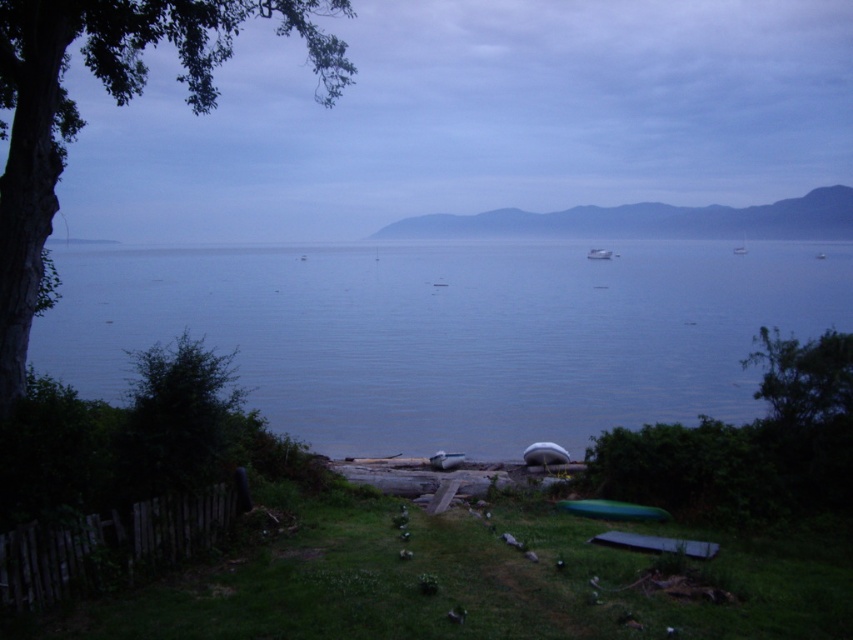
You are standing at the lakeside and want to reach the point marked at coordinates point (531, 445). Given that you can walk 15 meters before needing to rest, will you be able to reach that point without resting?

The distance between you and the point (531, 445) is 13.15 meters, which is less than your 15 meters walking capacity. Therefore, you can reach the point without needing to rest.

You are standing at the point marked by the coordinates (544, 454) in the image. What object is located exactly at that position?

The point at coordinates (544, 454) marks the location of the white rubber boat at center.

You are standing at the point with coordinates (451, 333) in the lakeside scene. What is the color of the object you are standing on?

The blue water at center is located at point (451, 333), so you are standing on blue water.